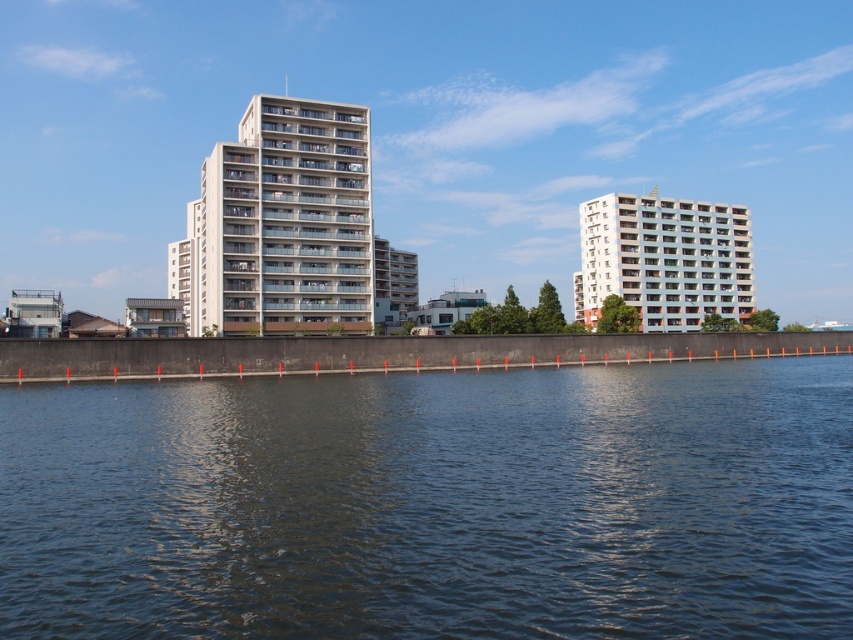
You are standing at the edge of the waterfront and want to reach the point marked as point [165,570]. Given that the distance between you and this point is 10.31 meters, can you estimate how far you need to walk to reach it?

The distance between you and point [165,570] is 10.31 meters, so you need to walk approximately 10.31 meters to reach it.

You are a city planner assessing the distance between two buildings for a new pedestrian walkway. The walkway requires a minimum of 50 meters between the buildings to accommodate safety regulations. Based on the scene, can the proposed walkway be constructed between the white concrete building at center and the white smooth building at right?

The white concrete building at center and the white smooth building at right are 55.80 meters apart, which exceeds the required 50 meters. Therefore, the proposed pedestrian walkway can be constructed between them as they meet the safety distance requirement.